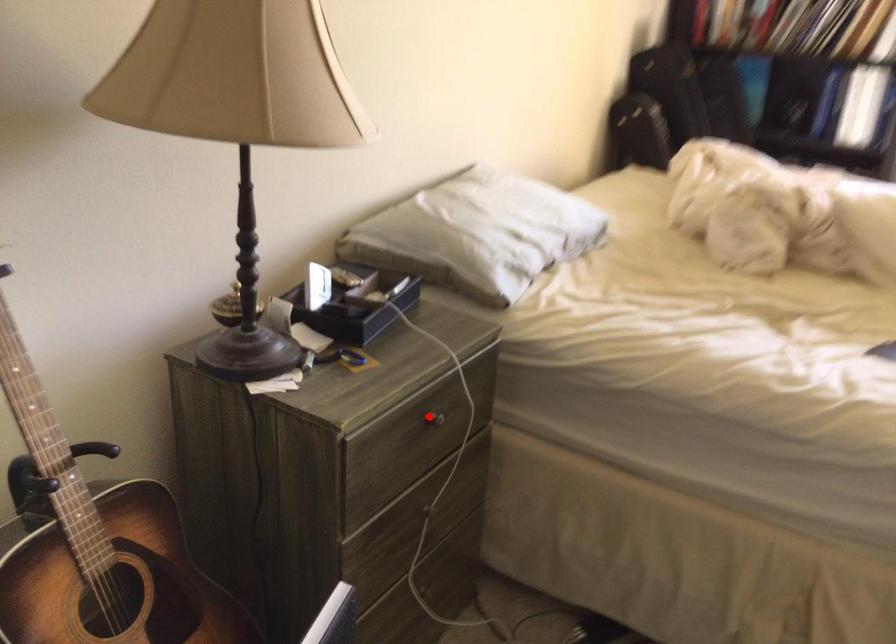
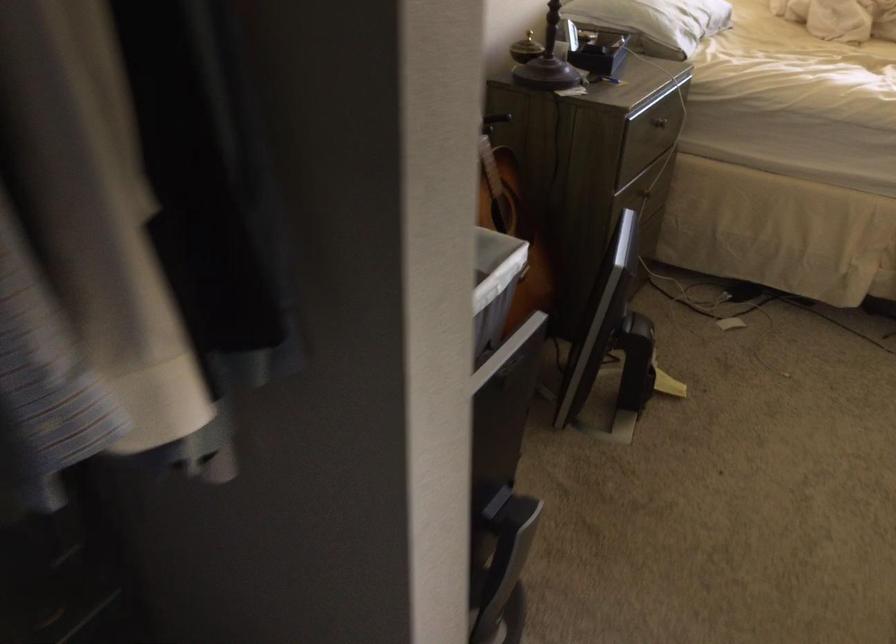
Question: I am providing you with two images of the same scene from different viewpoints. In image1, a red point is highlighted. Considering the same 3D point in image2, which of the following is correct?

Choices:
 (A) It is closer
 (B) It is farther

Answer: (B)